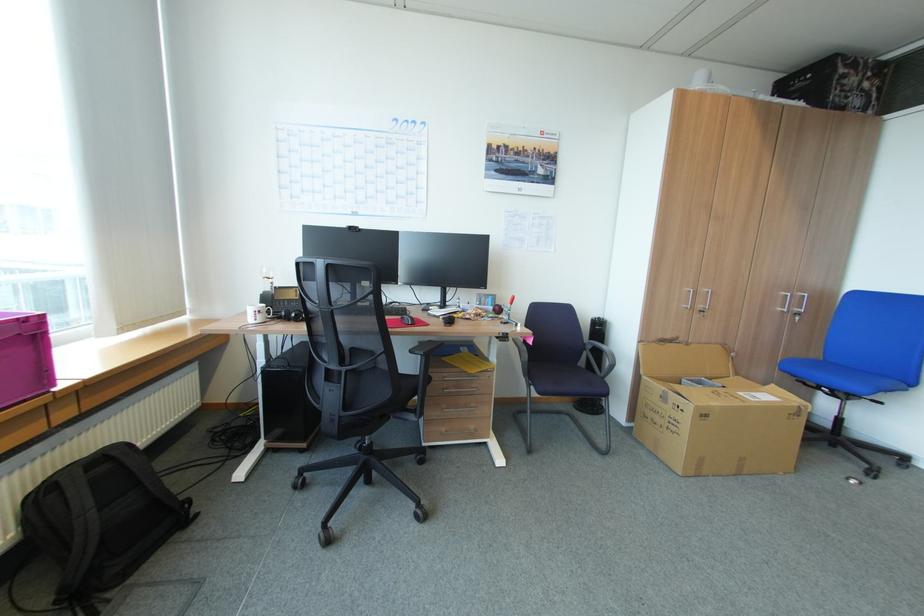
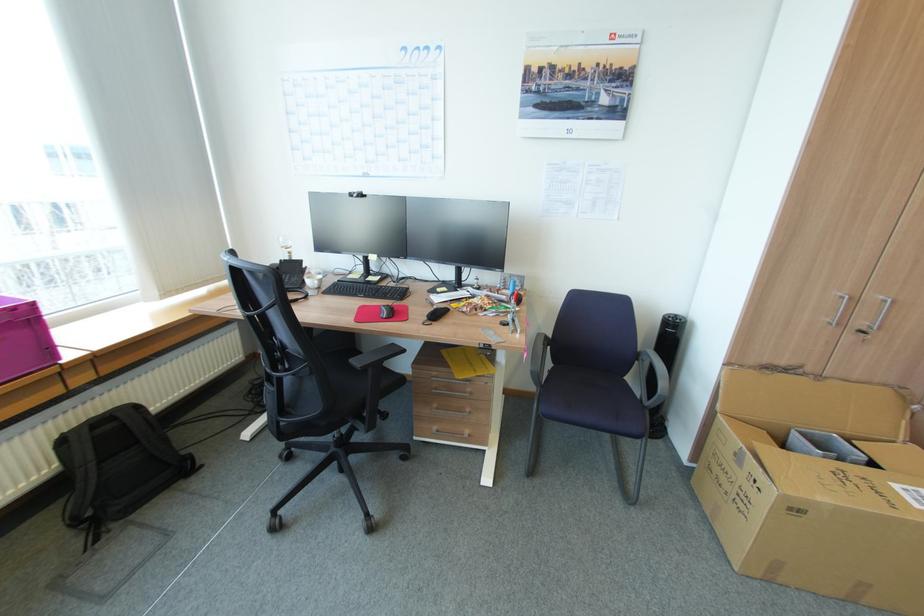
Locate, in the second image, the point that corresponds to (270,270) in the first image.

(286, 238)